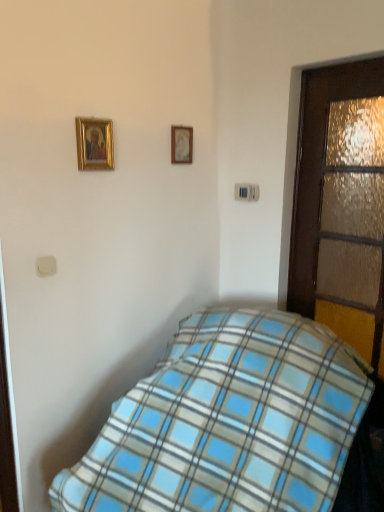
Question: Looking at the image, does gold-framed picture at upper left, the 2th picture frame in the right-to-left sequence, seem bigger or smaller compared to wooden textured door at right?

Choices:
 (A) big
 (B) small

Answer: (B)

Question: Is gold-framed picture at upper left, the 2th picture frame in the right-to-left sequence, inside the boundaries of wooden textured door at right, or outside?

Choices:
 (A) inside
 (B) outside

Answer: (B)

Question: Which object is positioned closest to the wooden picture frame at upper center, marked as the second picture frame in a left-to-right arrangement?

Choices:
 (A) blue plaid blanket at lower center
 (B) wooden textured door at right
 (C) gold-framed picture at upper left, the 1th picture frame viewed from the front

Answer: (C)

Question: Based on their relative distances, which object is nearer to the wooden textured door at right?

Choices:
 (A) wooden picture frame at upper center, which appears as the 1th picture frame when viewed from the back
 (B) blue plaid blanket at lower center
 (C) gold-framed picture at upper left, the 2th picture frame in the back-to-front sequence

Answer: (B)